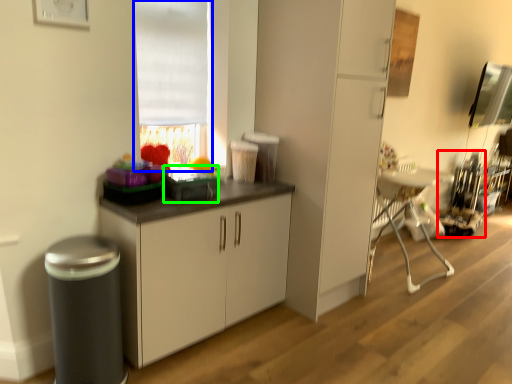
Question: Estimate the real-world distances between objects in this image. Which object is closer to appliance (highlighted by a red box), window (highlighted by a blue box) or appliance (highlighted by a green box)?

Choices:
 (A) window
 (B) appliance

Answer: (A)